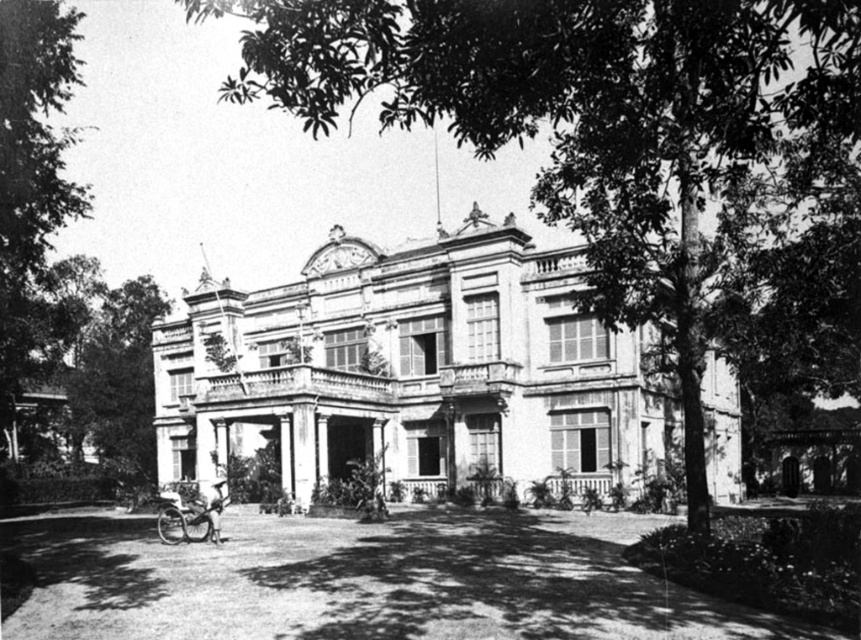
Which is in front, point (248, 401) or point (160, 524)?

Point (160, 524) is in front.

Who is taller, white stone mansion at center or wooden baby carriage at lower left?

white stone mansion at center

I want to click on white stone mansion at center, so click(x=413, y=369).